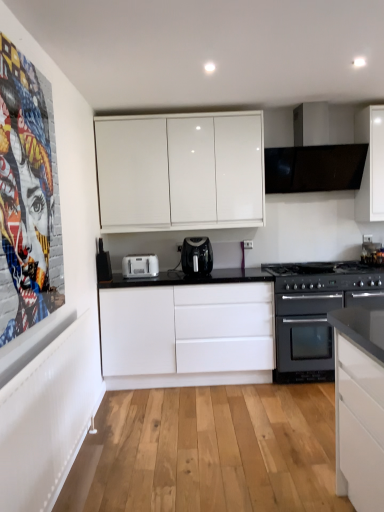
Question: From the image's perspective, is black matte oven at lower right, placed as the 2th appliance when sorted from left to right, located above or below white plastic toaster at center?

Choices:
 (A) above
 (B) below

Answer: (B)

Question: In terms of size, does black matte oven at lower right, which is the 1th appliance from right to left, appear bigger or smaller than white plastic toaster at center?

Choices:
 (A) big
 (B) small

Answer: (A)

Question: Estimate the real-world distances between objects in this image. Which object is farther from the black matte exhaust hood at upper right?

Choices:
 (A) white plastic toaster at center
 (B) white matte cabinet at center, which appears as the 2th cabinetry when viewed from the top
 (C) black plastic toaster at center, the 2th appliance from the right
 (D) black plastic air fryer at center
 (E) white glossy cabinet at upper center, marked as the second cabinetry in a bottom-to-top arrangement

Answer: (C)

Question: Which object is the closest to the white plastic toaster at center?

Choices:
 (A) black plastic toaster at center, the first appliance in the top-to-bottom sequence
 (B) black matte oven at lower right, which is the 2th appliance in top-to-bottom order
 (C) black matte exhaust hood at upper right
 (D) white matte cabinet at center, the 1th cabinetry ordered from the bottom
 (E) colorful collage at left

Answer: (A)